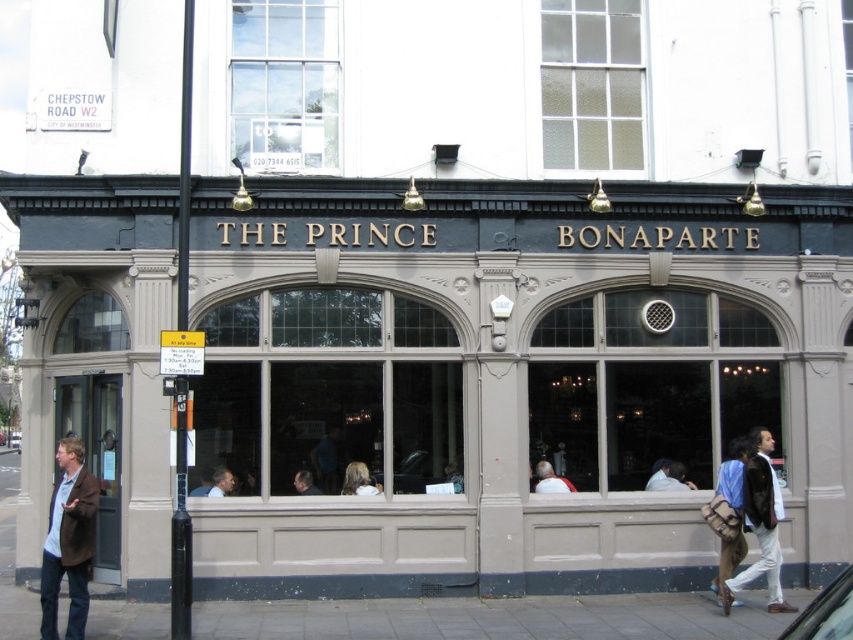
Based on the photo, who is lower down, brown leather jacket at lower left or dark brown leather jacket at center?

Positioned lower is dark brown leather jacket at center.

Does point (53, 608) come behind point (305, 476)?

No, it is not.

Find the location of a particular element. This screenshot has height=640, width=853. brown leather jacket at lower left is located at coordinates (68, 541).

Is gray concrete sidewalk at lower center positioned before light brown leather jacket at center?

Yes, it is.

Which is in front, point (550, 621) or point (543, 476)?

Point (550, 621) is more forward.

Find the location of `gray concrete sidewalk at lower center`. gray concrete sidewalk at lower center is located at coordinates (489, 618).

Which of these two, brown leather jacket at lower right or smooth brown hair at center, stands taller?

brown leather jacket at lower right is taller.

Measure the distance from brown leather jacket at lower right to smooth brown hair at center.

brown leather jacket at lower right is 5.50 meters from smooth brown hair at center.

Does point (778, 582) lie in front of point (215, 474)?

Yes, point (778, 582) is closer to viewer.

Find the location of a particular element. The width and height of the screenshot is (853, 640). brown leather jacket at lower right is located at coordinates (759, 524).